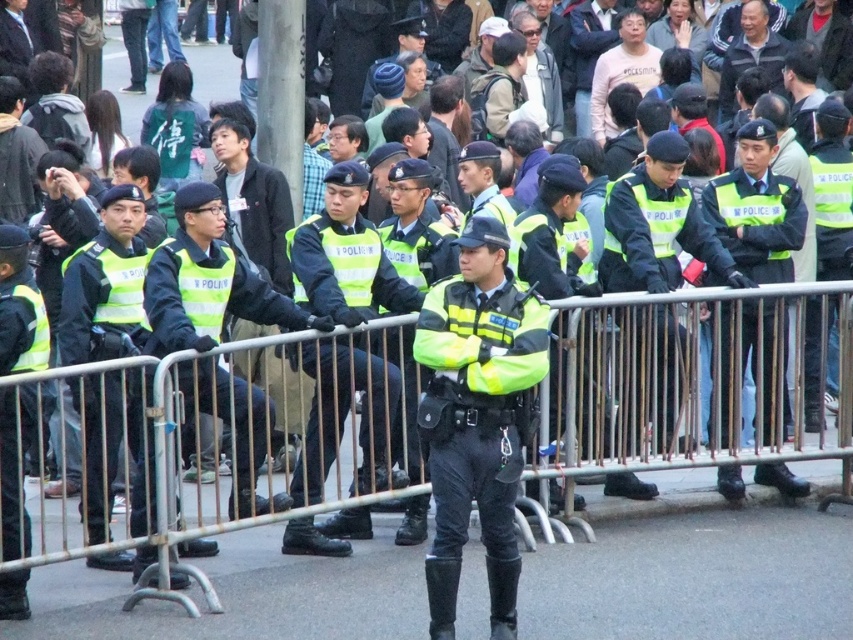
Question: Does neon yellow reflective uniform at center have a smaller size compared to reflective green vest at center?

Choices:
 (A) yes
 (B) no

Answer: (B)

Question: Is metallic silver rail at center wider than reflective green vest at center?

Choices:
 (A) yes
 (B) no

Answer: (A)

Question: Among these points, which one is farthest from the camera?

Choices:
 (A) (323, 296)
 (B) (500, 276)
 (C) (850, 300)

Answer: (C)

Question: Which object is the farthest from the metallic silver rail at center?

Choices:
 (A) neon yellow reflective uniform at center
 (B) high-visibility reflective jacket at center

Answer: (B)

Question: Where is reflective green vest at center located in relation to high-visibility reflective jacket at center in the image?

Choices:
 (A) left
 (B) right

Answer: (A)

Question: Which object appears closest to the camera in this image?

Choices:
 (A) metallic silver rail at center
 (B) reflective green vest at center
 (C) neon yellow reflective uniform at center

Answer: (A)